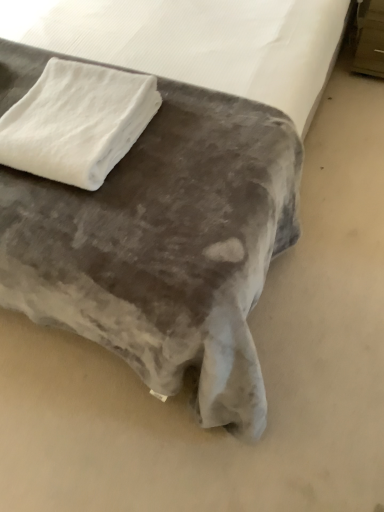
Identify the location of vacant region to the right of white soft towel at upper left. Image resolution: width=384 pixels, height=512 pixels. (194, 141).